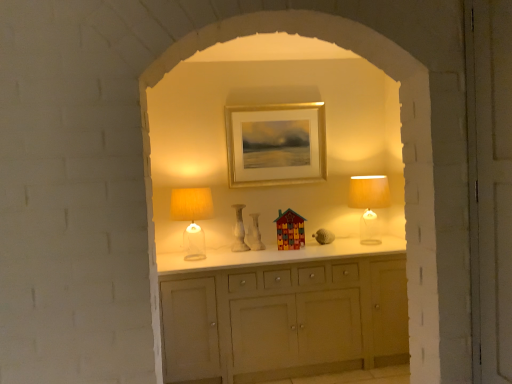
Question: From a real-world perspective, does translucent glass table lamp at right, which is counted as the first table lamp, starting from the right, sit lower than white marble vase at center, positioned as the first vase in left-to-right order?

Choices:
 (A) no
 (B) yes

Answer: (A)

Question: From a real-world perspective, is translucent glass table lamp at right, which is counted as the first table lamp, starting from the right, located higher than white marble vase at center, the second vase from the right?

Choices:
 (A) yes
 (B) no

Answer: (A)

Question: Does translucent glass table lamp at right, marked as the second table lamp in a left-to-right arrangement, have a smaller size compared to white marble vase at center, positioned as the first vase in left-to-right order?

Choices:
 (A) yes
 (B) no

Answer: (B)

Question: Is translucent glass table lamp at right, which is counted as the first table lamp, starting from the right, thinner than white marble vase at center, positioned as the first vase in left-to-right order?

Choices:
 (A) yes
 (B) no

Answer: (B)

Question: Is translucent glass table lamp at right, marked as the second table lamp in a left-to-right arrangement, bigger than white marble vase at center, the second vase from the right?

Choices:
 (A) no
 (B) yes

Answer: (B)

Question: Is point pyautogui.click(x=356, y=205) closer or farther from the camera than point pyautogui.click(x=315, y=129)?

Choices:
 (A) closer
 (B) farther

Answer: (A)

Question: From the image's perspective, is translucent glass table lamp at right, marked as the second table lamp in a left-to-right arrangement, positioned above or below gold metallic picture frame at center?

Choices:
 (A) above
 (B) below

Answer: (B)

Question: In the image, is translucent glass table lamp at right, marked as the second table lamp in a left-to-right arrangement, on the left side or the right side of gold metallic picture frame at center?

Choices:
 (A) right
 (B) left

Answer: (A)

Question: Is translucent glass table lamp at right, marked as the second table lamp in a left-to-right arrangement, bigger or smaller than gold metallic picture frame at center?

Choices:
 (A) small
 (B) big

Answer: (B)

Question: Is point [294, 220] closer or farther from the camera than point [358, 180]?

Choices:
 (A) closer
 (B) farther

Answer: (A)

Question: Is multicolored wooden house at center wider or thinner than translucent glass table lamp at right, which is counted as the first table lamp, starting from the right?

Choices:
 (A) wide
 (B) thin

Answer: (B)

Question: Considering the positions of multicolored wooden house at center and translucent glass table lamp at right, which is counted as the first table lamp, starting from the right, in the image, is multicolored wooden house at center bigger or smaller than translucent glass table lamp at right, which is counted as the first table lamp, starting from the right,?

Choices:
 (A) small
 (B) big

Answer: (A)

Question: From their relative heights in the image, would you say multicolored wooden house at center is taller or shorter than translucent glass table lamp at right, which is counted as the first table lamp, starting from the right?

Choices:
 (A) tall
 (B) short

Answer: (B)

Question: From their relative heights in the image, would you say translucent glass table lamp at left, the 2th table lamp viewed from the right, is taller or shorter than white marble vase at center, the second vase from the right?

Choices:
 (A) tall
 (B) short

Answer: (A)

Question: Would you say translucent glass table lamp at left, the 2th table lamp viewed from the right, is to the left or to the right of white marble vase at center, positioned as the first vase in left-to-right order, in the picture?

Choices:
 (A) left
 (B) right

Answer: (A)